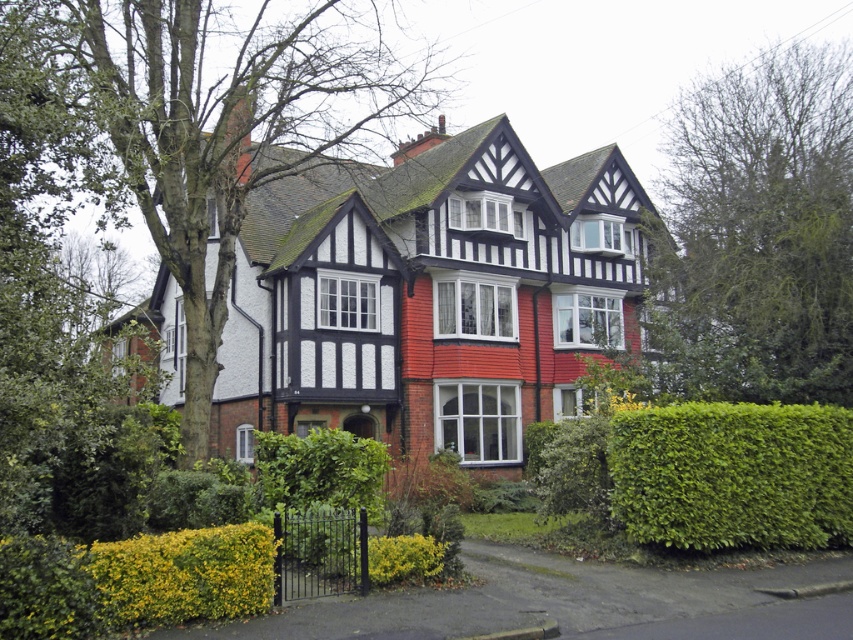
You are standing in the front yard of the Tudor house and want to walk from the green leafy tree at left to the green leafy hedge at lower right. Which direction should you move relative to the tree?

You should move towards the lower right direction from the green leafy tree at left to reach the green leafy hedge at lower right, as the hedge is positioned at lower right relative to the tree.

You are a gardener planning to trim the green leafy tree at left and the green leafy hedge at center. Based on their positions, which one should you start with to avoid debris falling onto the other?

Result: The green leafy tree at left is positioned over the green leafy hedge at center, so you should start trimming the green leafy tree at left first to prevent debris from falling onto the green leafy hedge at center.

In the scene shown: You are standing in front of the Tudor house and notice two points marked on the facade. The first point is at coordinate (154, 179) and the second is at (679, 532). Which point is closer to you?

Point (154, 179) is closer to you because it is further to the viewer than point (679, 532).